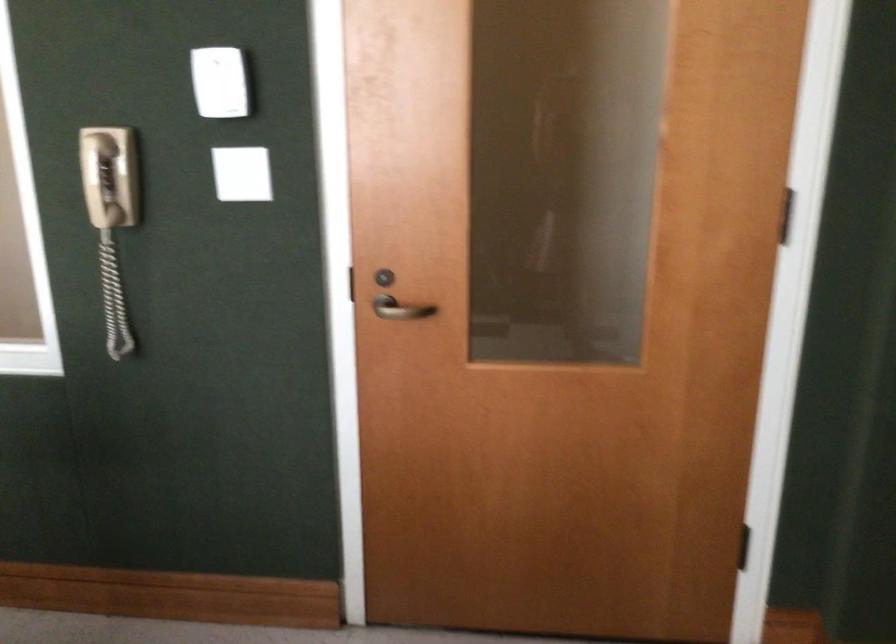
This screenshot has height=644, width=896. What are the coordinates of `dark door handle` in the screenshot? It's located at (401, 308).